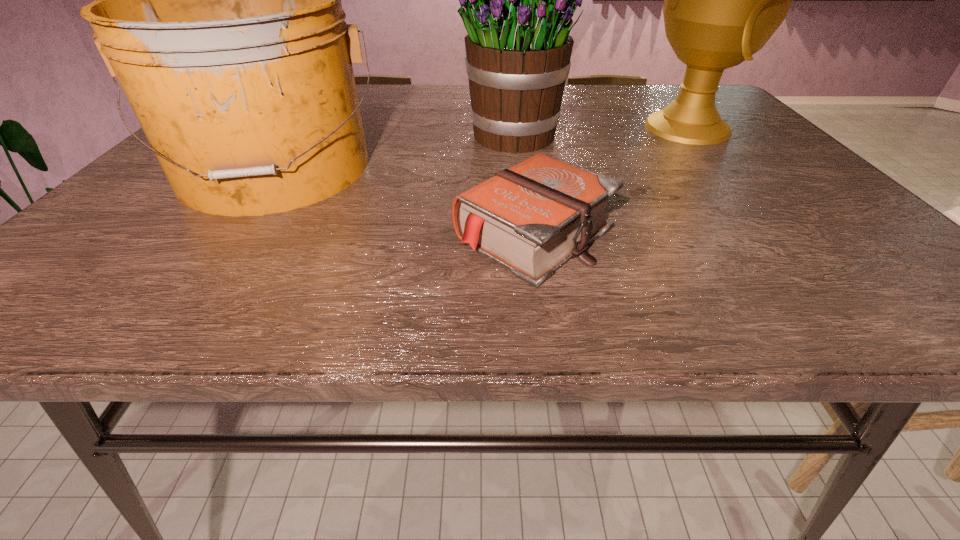
Where is `free region located 0.050m on the back of the second shortest object`? This screenshot has height=540, width=960. free region located 0.050m on the back of the second shortest object is located at coordinates (310, 122).

Locate an element on the screen. This screenshot has height=540, width=960. vacant region located on the left of the shortest object is located at coordinates (323, 234).

I want to click on object that is positioned at the far edge, so click(723, 0).

Locate an element on the screen. The image size is (960, 540). object that is at the near edge is located at coordinates (531, 218).

You are a GUI agent. You are given a task and a screenshot of the screen. Output one action in this format:
    pyautogui.click(x=<x>, y=<y>)
    Task: Click on the object at the left edge
    
    Given the screenshot: What is the action you would take?
    pyautogui.click(x=218, y=8)

You are a GUI agent. You are given a task and a screenshot of the screen. Output one action in this format:
    pyautogui.click(x=<x>, y=<y>)
    Task: Click on the object at the right edge
    
    Given the screenshot: What is the action you would take?
    pyautogui.click(x=723, y=0)

The image size is (960, 540). Find the location of `object at the far right corner`. object at the far right corner is located at coordinates (723, 0).

The height and width of the screenshot is (540, 960). Find the location of `vacant space at the near edge of the desktop`. vacant space at the near edge of the desktop is located at coordinates (172, 292).

The height and width of the screenshot is (540, 960). In order to click on vacant point at the left edge in this screenshot , I will do `click(132, 221)`.

Where is `free space at the right edge`? The image size is (960, 540). free space at the right edge is located at coordinates (795, 178).